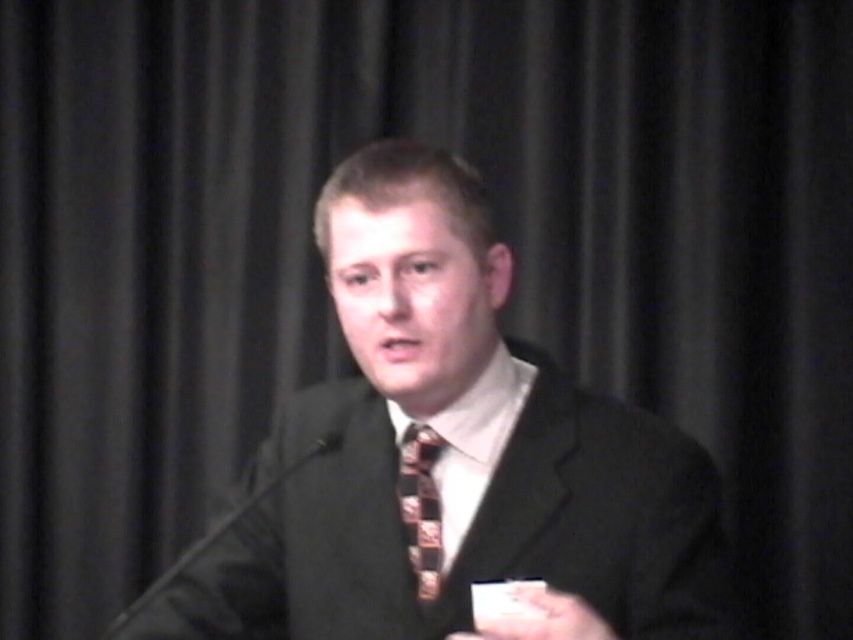
Question: Is matte black suit at center further to the viewer compared to patterned silk tie at center?

Choices:
 (A) yes
 (B) no

Answer: (B)

Question: Which point is farther from the camera taking this photo?

Choices:
 (A) (469, 376)
 (B) (404, 458)
 (C) (563, 618)

Answer: (B)

Question: Is matte black suit at center wider than patterned silk tie at center?

Choices:
 (A) no
 (B) yes

Answer: (B)

Question: Can you confirm if matte black suit at center is positioned to the right of smooth white paper at center?

Choices:
 (A) no
 (B) yes

Answer: (A)

Question: Which object is farther from the camera taking this photo?

Choices:
 (A) patterned silk tie at center
 (B) smooth white paper at center
 (C) matte black suit at center

Answer: (A)

Question: Which of the following is the closest to the observer?

Choices:
 (A) (596, 614)
 (B) (422, 426)
 (C) (221, 570)

Answer: (A)